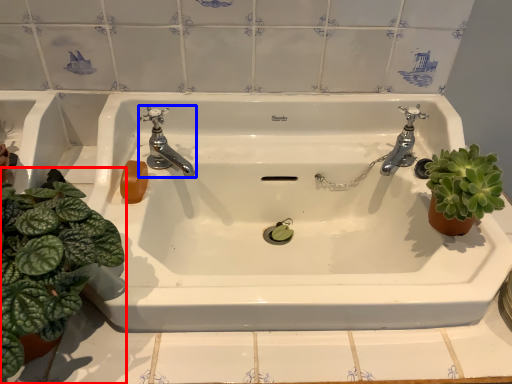
Question: Which object appears farthest to the camera in this image, houseplant (highlighted by a red box) or tap (highlighted by a blue box)?

Choices:
 (A) houseplant
 (B) tap

Answer: (B)